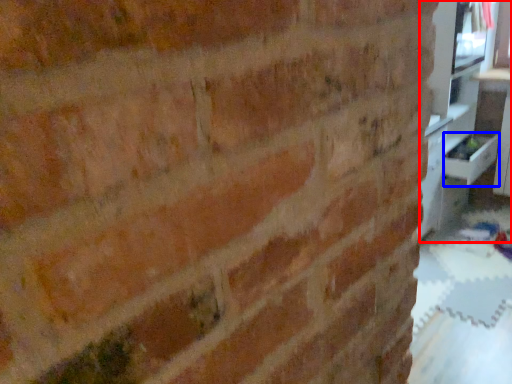
Question: Which object is closer to the camera taking this photo, entertainment center (highlighted by a red box) or drawer (highlighted by a blue box)?

Choices:
 (A) entertainment center
 (B) drawer

Answer: (A)